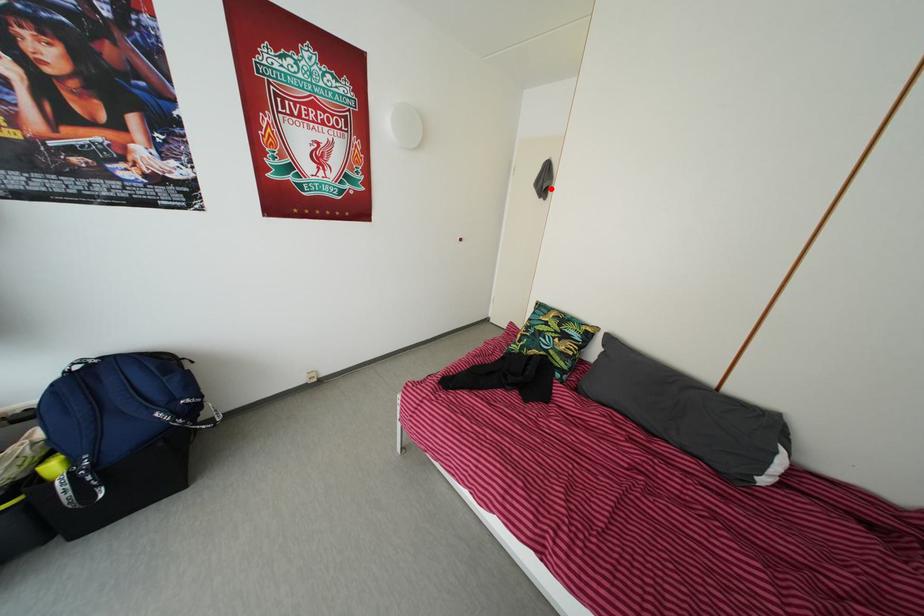
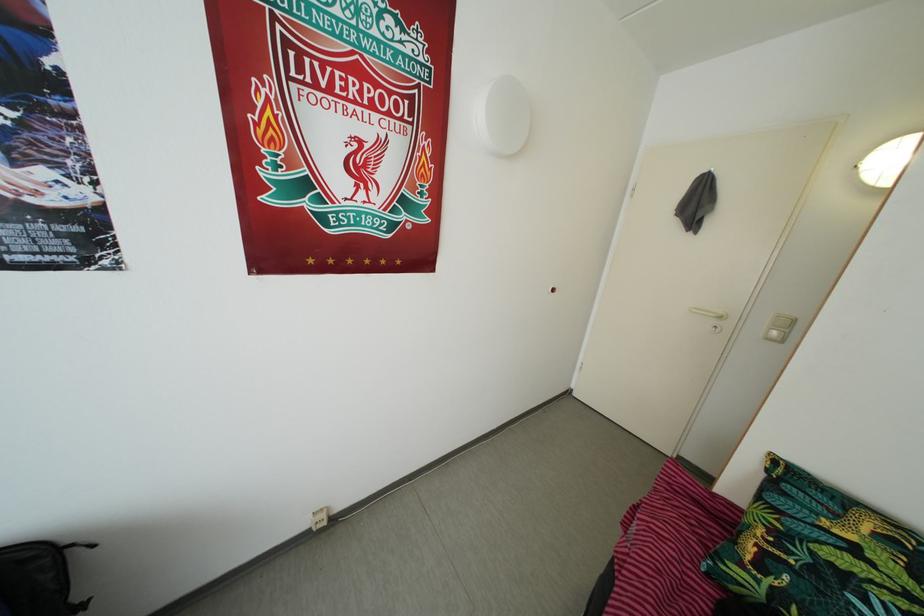
Locate, in the second image, the point that corresponds to the highlighted location in the first image.

(703, 213)